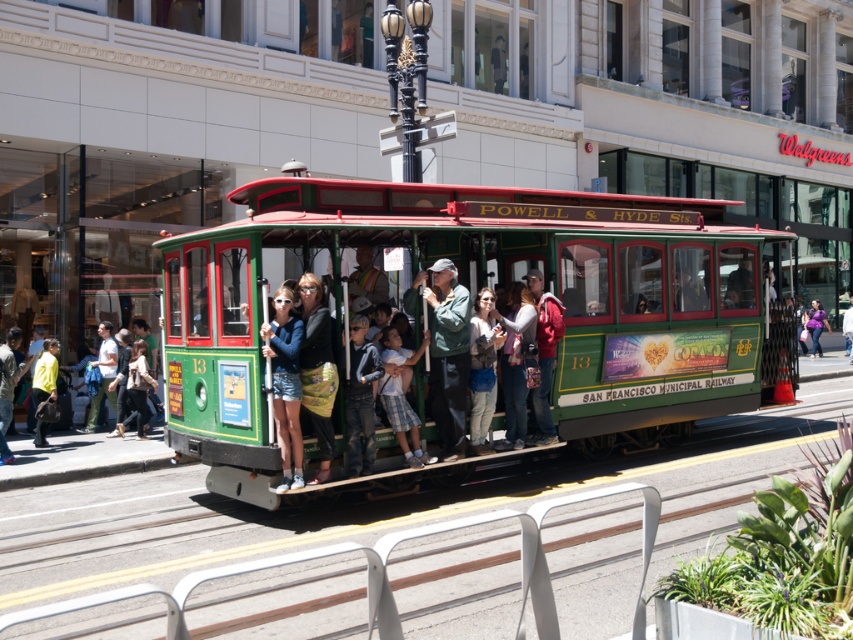
You are a photographer standing on the sidewalk trying to take a clear photo of the green polished wood cable car at center. However, there is a person wearing a matte blue jacket at center blocking your view. Can you move to the left or right to avoid the person?

The matte blue jacket at center is behind the green polished wood cable car at center, so you can move to either the left or right side of the green polished wood cable car at center to avoid the person wearing the matte blue jacket at center and get a clear shot.

You are a tour guide standing on the sidewalk next to the green polished wood cable car at center. You need to hand a brochure to the person wearing the matte blue jacket at center. Can you reach them without leaving your spot?

The distance between the green polished wood cable car at center and the matte blue jacket at center is 6.66 meters, so you cannot reach them without moving from your current position.

You are a tourist standing on the sidewalk and see both the green polished wood cable car at center and the green fabric coach at center. Which one is positioned more to the right side?

The green polished wood cable car at center is positioned to the right of the green fabric coach at center, so it is more to the right side.